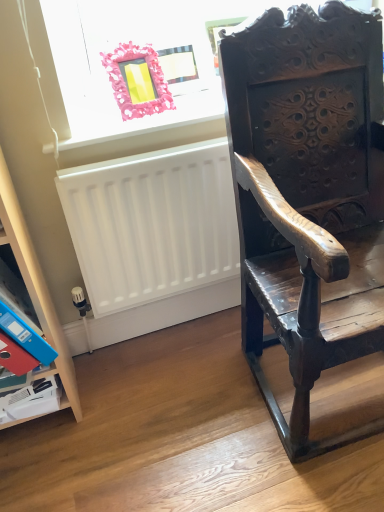
Find the location of a particular element. vacant area that is situated to the right of wooden shelf at lower left is located at coordinates (120, 396).